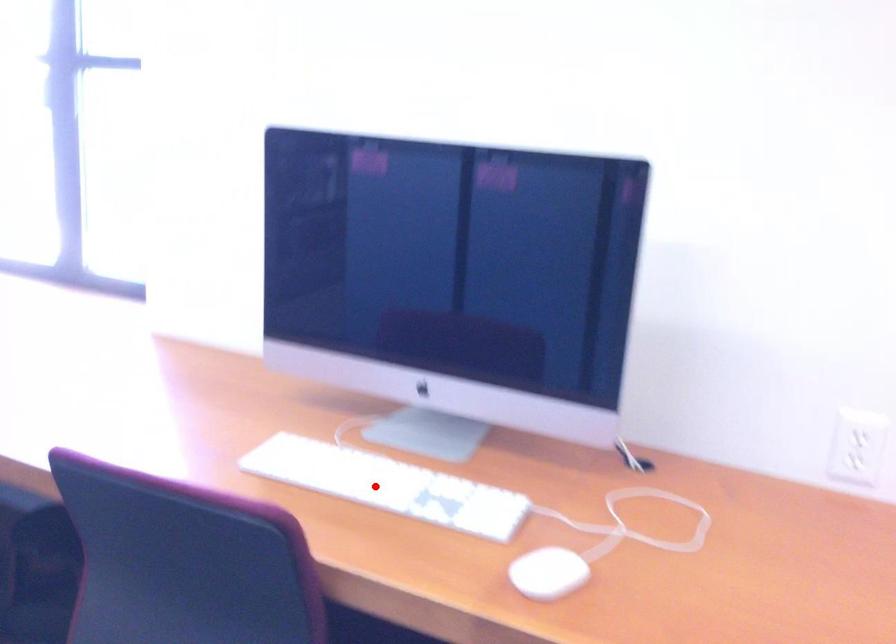
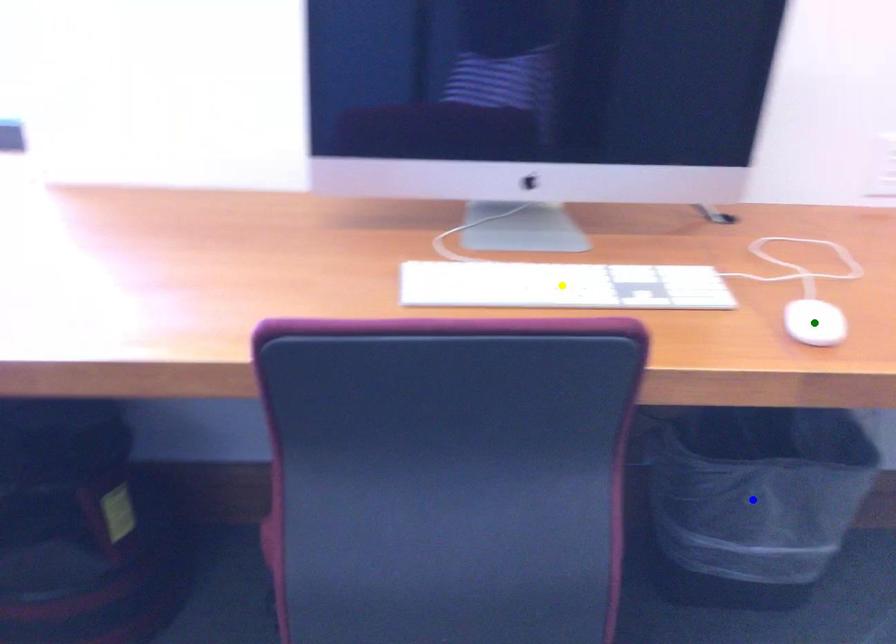
Question: I am providing you with two images of the same scene from different viewpoints. A red point is marked on the first image. You are given multiple points on the second image. Which point in image 2 is actually the same real-world point as the red point in image 1?

Choices:
 (A) blue point
 (B) green point
 (C) yellow point

Answer: (C)